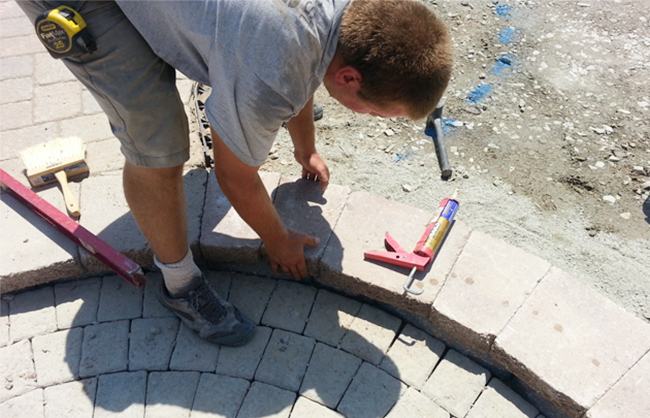
You are a GUI agent. You are given a task and a screenshot of the screen. Output one action in this format:
    pyautogui.click(x=<x>, y=<y>)
    Task: Click on the brush handle
    
    Given the screenshot: What is the action you would take?
    tap(71, 198)